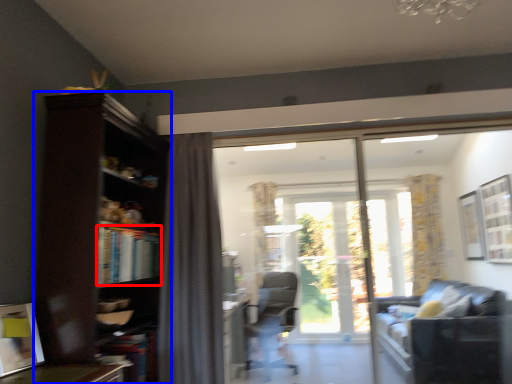
Question: Which object appears farthest to the camera in this image, book (highlighted by a red box) or bookcase (highlighted by a blue box)?

Choices:
 (A) book
 (B) bookcase

Answer: (A)